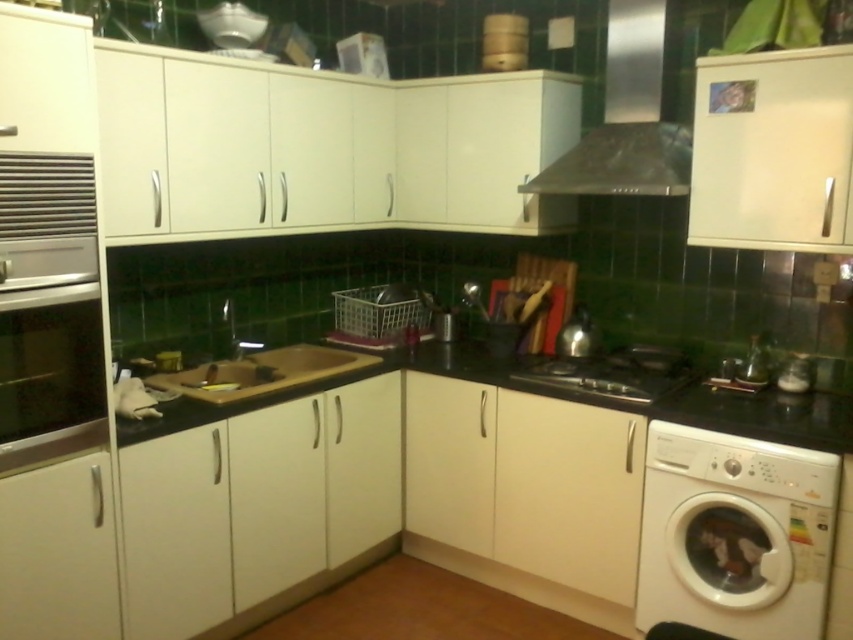
Question: Where is white glossy cabinet at upper center located in relation to stainless steel stove at center in the image?

Choices:
 (A) left
 (B) right

Answer: (A)

Question: Does black matte countertop at center have a larger size compared to stainless steel stove at center?

Choices:
 (A) no
 (B) yes

Answer: (B)

Question: Which of the following is the farthest from the observer?

Choices:
 (A) brown matte cutting board at center
 (B) black matte countertop at center
 (C) stainless steel stove at center

Answer: (C)

Question: Which point is farther from the camera taking this photo?

Choices:
 (A) 306,365
 (B) 642,8

Answer: (A)

Question: Can you confirm if stainless steel exhaust hood at upper center is positioned below brown matte cutting board at center?

Choices:
 (A) no
 (B) yes

Answer: (A)

Question: Estimate the real-world distances between objects in this image. Which object is closer to the black matte countertop at center?

Choices:
 (A) white plastic washing machine at lower right
 (B) stainless steel stove at center
 (C) brown matte cutting board at center

Answer: (B)